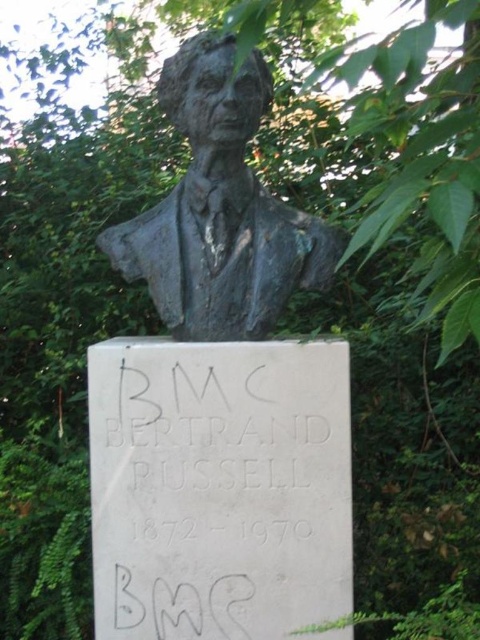
Question: Where is white stone plaque at center located in relation to bronze bust at center in the image?

Choices:
 (A) right
 (B) left

Answer: (A)

Question: Observing the image, what is the correct spatial positioning of white stone plaque at center in reference to bronze bust at center?

Choices:
 (A) below
 (B) above

Answer: (A)

Question: Can you confirm if white stone plaque at center is smaller than bronze bust at center?

Choices:
 (A) yes
 (B) no

Answer: (B)

Question: Which point is farther from the camera taking this photo?

Choices:
 (A) (168, 60)
 (B) (192, 516)

Answer: (A)

Question: Among these points, which one is farthest from the camera?

Choices:
 (A) (133, 404)
 (B) (195, 188)

Answer: (B)